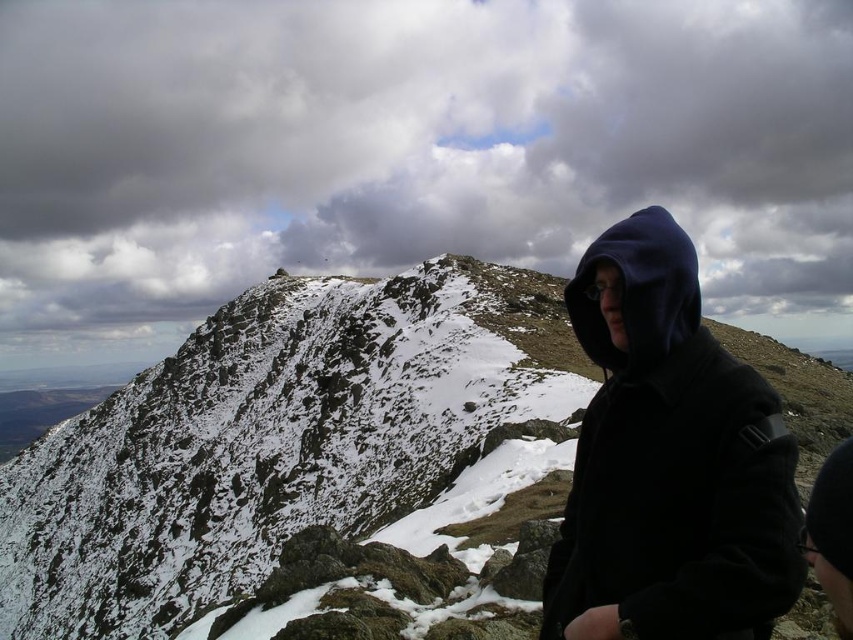
Who is more distant from viewer, (126, 412) or (643, 323)?

Point (126, 412)

Who is positioned more to the left, snowy rocky mountain at upper center or navy blue hoodie at right?

snowy rocky mountain at upper center is more to the left.

Image resolution: width=853 pixels, height=640 pixels. I want to click on snowy rocky mountain at upper center, so click(274, 440).

Locate an element on the screen. snowy rocky mountain at upper center is located at coordinates (274, 440).

Can you confirm if snowy rocky mountain at upper center is smaller than matte black hoodie at right?

No, snowy rocky mountain at upper center is not smaller than matte black hoodie at right.

This screenshot has height=640, width=853. What do you see at coordinates (274, 440) in the screenshot?
I see `snowy rocky mountain at upper center` at bounding box center [274, 440].

You are a GUI agent. You are given a task and a screenshot of the screen. Output one action in this format:
    pyautogui.click(x=<x>, y=<y>)
    Task: Click on the snowy rocky mountain at upper center
    The height and width of the screenshot is (640, 853).
    Given the screenshot: What is the action you would take?
    pyautogui.click(x=274, y=440)

Is point (680, 428) more distant than point (662, 262)?

No.

Is matte black hoodie at right wider than navy blue hoodie at right?

Incorrect, matte black hoodie at right's width does not surpass navy blue hoodie at right's.

You are a GUI agent. You are given a task and a screenshot of the screen. Output one action in this format:
    pyautogui.click(x=<x>, y=<y>)
    Task: Click on the matte black hoodie at right
    Image resolution: width=853 pixels, height=640 pixels.
    Given the screenshot: What is the action you would take?
    pyautogui.click(x=668, y=461)